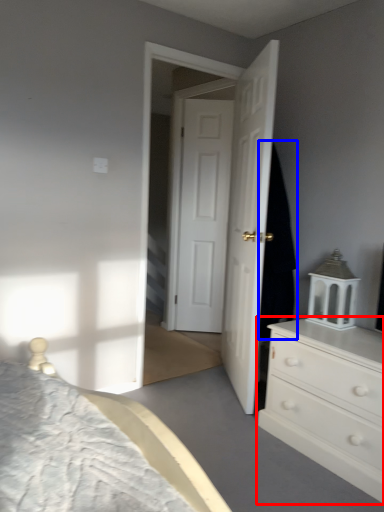
Question: Which object is further to the camera taking this photo, chest of drawers (highlighted by a red box) or dark (highlighted by a blue box)?

Choices:
 (A) chest of drawers
 (B) dark

Answer: (B)